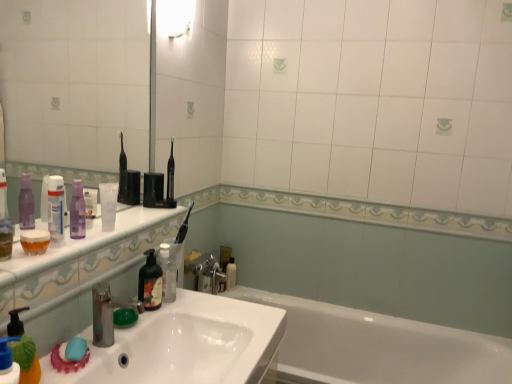
Image resolution: width=512 pixels, height=384 pixels. In order to click on vacant area located to the right-hand side of translucent plastic bottle at sink in this screenshot , I will do `click(207, 305)`.